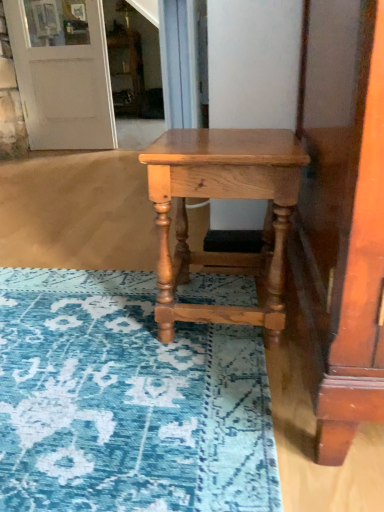
Question: In terms of width, does natural wood table at center look wider or thinner when compared to white matte door at upper left?

Choices:
 (A) wide
 (B) thin

Answer: (A)

Question: Is natural wood table at center inside or outside of white matte door at upper left?

Choices:
 (A) outside
 (B) inside

Answer: (A)

Question: Visually, is natural wood table at center positioned to the left or to the right of white matte door at upper left?

Choices:
 (A) right
 (B) left

Answer: (A)

Question: Based on their sizes in the image, would you say white matte door at upper left is bigger or smaller than natural wood table at center?

Choices:
 (A) big
 (B) small

Answer: (A)

Question: From the image's perspective, is white matte door at upper left above or below natural wood table at center?

Choices:
 (A) above
 (B) below

Answer: (A)

Question: From a real-world perspective, is white matte door at upper left positioned above or below natural wood table at center?

Choices:
 (A) above
 (B) below

Answer: (A)

Question: Is white matte door at upper left in front of or behind natural wood table at center in the image?

Choices:
 (A) behind
 (B) front

Answer: (A)